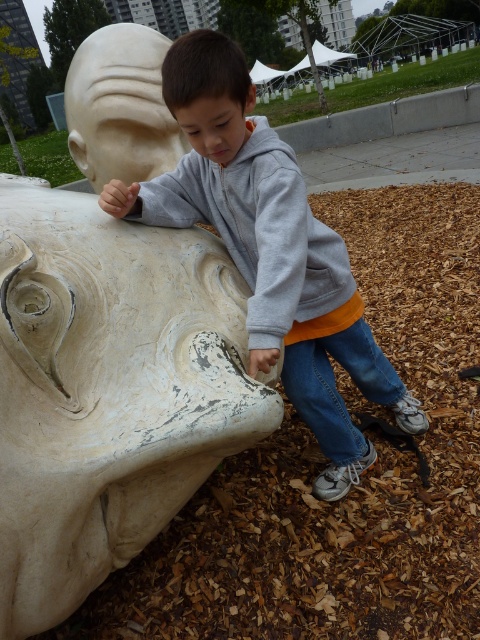
Is point (204, 163) positioned behind point (206, 109)?

Yes, it is behind point (206, 109).

Is the position of gray matte hoodie at center less distant than that of white matte sculpture at center?

Yes, it is in front of white matte sculpture at center.

Is point (240, 81) farther from viewer compared to point (184, 67)?

That is True.

Find the location of a particular element. This screenshot has height=640, width=480. gray matte hoodie at center is located at coordinates (268, 250).

What do you see at coordinates (261, 232) in the screenshot? The width and height of the screenshot is (480, 640). I see `gray fleece sweatshirt at upper center` at bounding box center [261, 232].

Which is behind, point (299, 289) or point (241, 109)?

Point (241, 109)

At what (x,y) coordinates should I click in order to perform the action: click on gray fleece sweatshirt at upper center. Please return your answer as a coordinate pair (x, y). The image size is (480, 640). Looking at the image, I should click on (261, 232).

Which is more to the left, white weathered stone bust at lower left or gray matte hoodie at center?

white weathered stone bust at lower left

Between point (96, 364) and point (346, 362), which one is positioned in front?

Positioned in front is point (96, 364).

Which is in front, point (29, 368) or point (231, 147)?

Point (29, 368)

The width and height of the screenshot is (480, 640). What are the coordinates of `white weathered stone bust at lower left` in the screenshot? It's located at (108, 390).